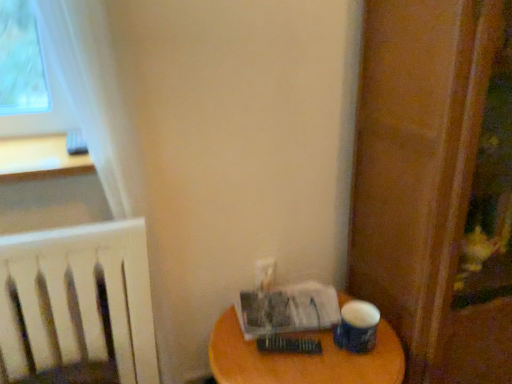
Question: Does wooden table at lower right have a smaller size compared to wooden screen door at right?

Choices:
 (A) yes
 (B) no

Answer: (A)

Question: Is wooden table at lower right far from wooden screen door at right?

Choices:
 (A) no
 (B) yes

Answer: (A)

Question: Is wooden table at lower right positioned before wooden screen door at right?

Choices:
 (A) yes
 (B) no

Answer: (B)

Question: From a real-world perspective, does wooden table at lower right stand above wooden screen door at right?

Choices:
 (A) no
 (B) yes

Answer: (A)

Question: Is wooden table at lower right completely or partially outside of wooden screen door at right?

Choices:
 (A) no
 (B) yes

Answer: (B)

Question: Does wooden table at lower right appear on the right side of wooden screen door at right?

Choices:
 (A) no
 (B) yes

Answer: (A)

Question: Is white paper at lower right, positioned as the first paperback book in back-to-front order, smaller than wooden table at lower right?

Choices:
 (A) no
 (B) yes

Answer: (B)

Question: Considering the relative sizes of white paper at lower right, positioned as the first paperback book in back-to-front order, and wooden table at lower right in the image provided, is white paper at lower right, positioned as the first paperback book in back-to-front order, taller than wooden table at lower right?

Choices:
 (A) yes
 (B) no

Answer: (B)

Question: Is white paper at lower right, arranged as the 2th paperback book when viewed from the front, outside wooden table at lower right?

Choices:
 (A) yes
 (B) no

Answer: (A)

Question: Is white paper at lower right, positioned as the first paperback book in back-to-front order, thinner than wooden table at lower right?

Choices:
 (A) no
 (B) yes

Answer: (B)

Question: Is white paper at lower right, arranged as the 2th paperback book when viewed from the front, far away from wooden table at lower right?

Choices:
 (A) no
 (B) yes

Answer: (A)

Question: Could you tell me if white paper at lower right, arranged as the 2th paperback book when viewed from the front, is facing wooden table at lower right?

Choices:
 (A) no
 (B) yes

Answer: (A)

Question: Does white paper at lower right, arranged as the 2th paperback book when viewed from the front, have a greater width compared to hardcover book at center, marked as the first paperback book in a front-to-back arrangement?

Choices:
 (A) yes
 (B) no

Answer: (A)